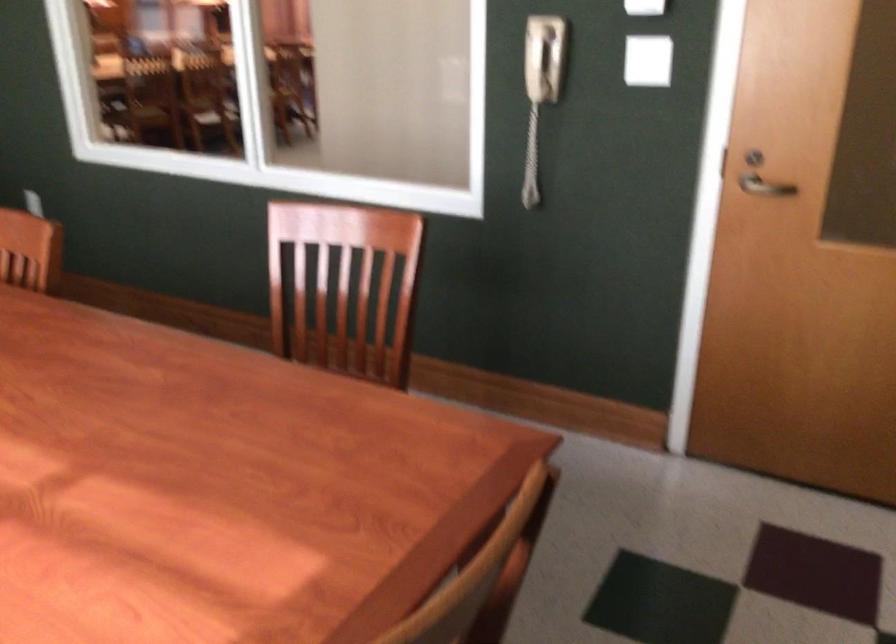
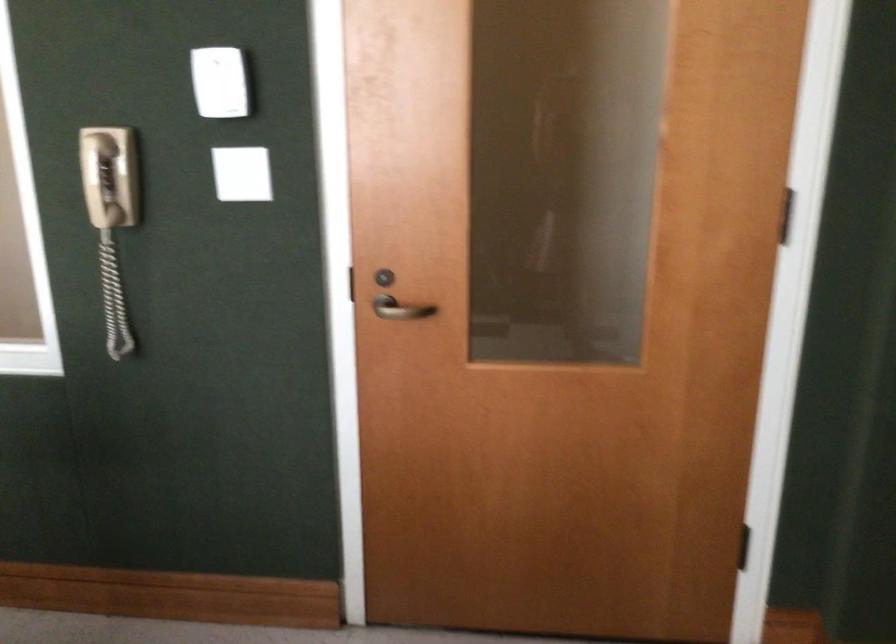
In the second image, find the point that corresponds to [721,158] in the first image.

(346, 283)